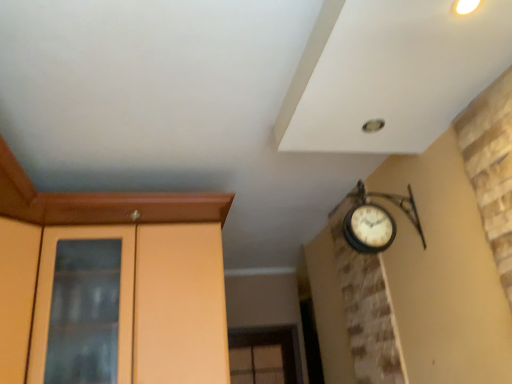
Question: Does matte wood dresser at left come behind matte wood door at left?

Choices:
 (A) yes
 (B) no

Answer: (A)

Question: Would you consider matte wood dresser at left to be distant from matte wood door at left?

Choices:
 (A) no
 (B) yes

Answer: (A)

Question: Is matte wood dresser at left outside of matte wood door at left?

Choices:
 (A) no
 (B) yes

Answer: (B)

Question: Is matte wood dresser at left facing towards matte wood door at left?

Choices:
 (A) yes
 (B) no

Answer: (B)

Question: From a real-world perspective, is matte wood dresser at left physically above matte wood door at left?

Choices:
 (A) no
 (B) yes

Answer: (A)

Question: Is matte wood dresser at left closer to the viewer compared to matte wood door at left?

Choices:
 (A) yes
 (B) no

Answer: (B)

Question: From a real-world perspective, is matte wood door at left over matte wood dresser at left?

Choices:
 (A) yes
 (B) no

Answer: (A)

Question: Is matte wood door at left closer to the viewer compared to matte wood dresser at left?

Choices:
 (A) no
 (B) yes

Answer: (B)

Question: Is matte wood door at left at the left side of matte wood dresser at left?

Choices:
 (A) yes
 (B) no

Answer: (A)

Question: Is matte wood door at left next to matte wood dresser at left and touching it?

Choices:
 (A) no
 (B) yes

Answer: (A)

Question: From a real-world perspective, is matte wood door at left located beneath matte wood dresser at left?

Choices:
 (A) yes
 (B) no

Answer: (B)

Question: Can you confirm if matte wood door at left is positioned to the right of matte wood dresser at left?

Choices:
 (A) yes
 (B) no

Answer: (B)

Question: In the image, is matte wood dresser at left on the left side or the right side of matte wood door at left?

Choices:
 (A) right
 (B) left

Answer: (A)